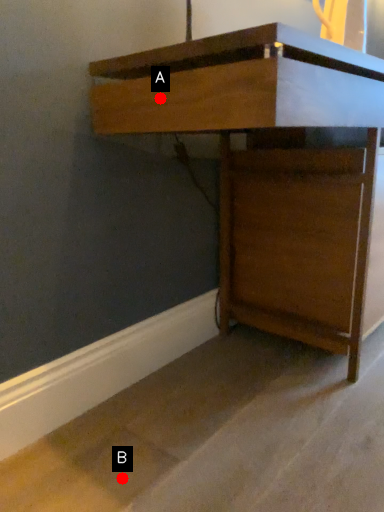
Question: Two points are circled on the image, labeled by A and B beside each circle. Among these points, which one is farthest from the camera?

Choices:
 (A) A is further
 (B) B is further

Answer: (B)